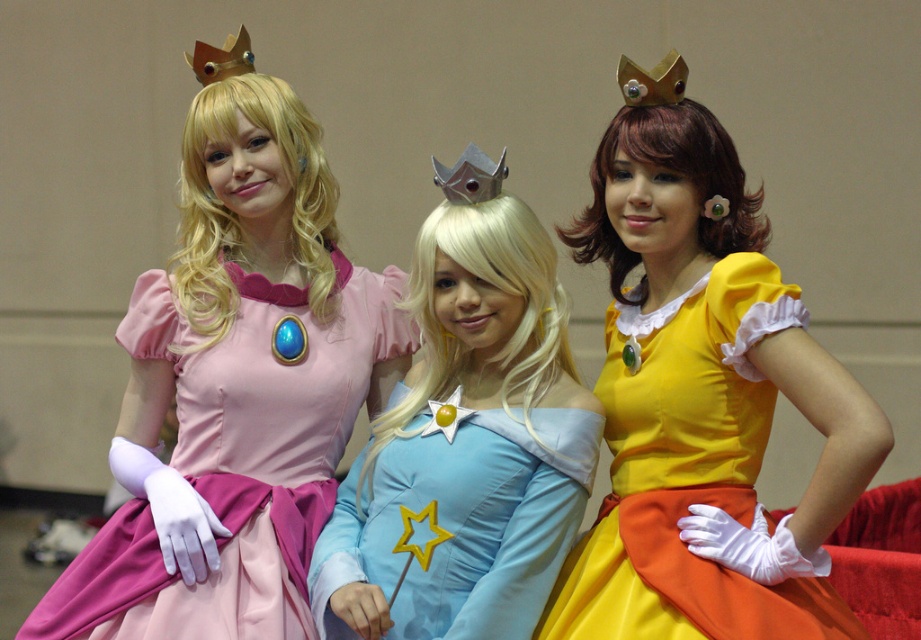
You are a photographer taking a picture of the light blue satin dress at center and the matte pink fabric dress at left. Which dress should you focus on first to ensure both are in focus?

You should focus on the light blue satin dress at center first because it is closer to the viewer than the matte pink fabric dress at left, so adjusting focus from near to far will help both be in focus.

You are standing in front of the three princesses. You notice two points marked on the image at coordinates point (558, 440) and point (301, 442). Which point is closer to you?

Point (558, 440) is in front of point (301, 442), so it is closer to you.

Based on the photo, you are a photographer setting up a shoot for a princess photoshoot. You need to ensure that both the light blue satin dress at center and the matte pink fabric dress at left are fully visible in the frame. Based on their current positions, is there any part of either dress that might be blocked from view?

The light blue satin dress at center is positioned over the matte pink fabric dress at left, so parts of the matte pink fabric dress at left may be blocked by the light blue satin dress at center. The light blue satin dress at center is fully visible, but the matte pink fabric dress at left might have some areas hidden underneath.